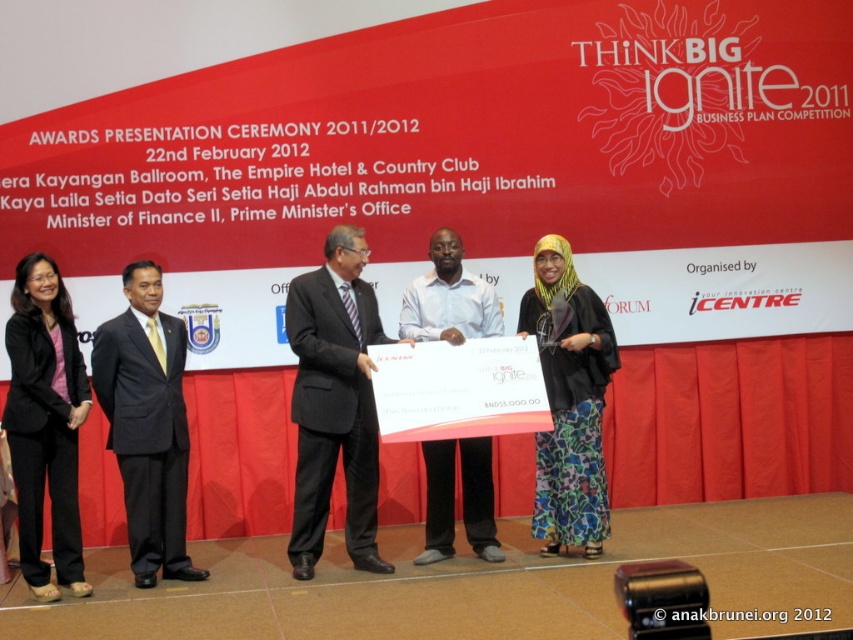
Question: Among these points, which one is farthest from the camera?

Choices:
 (A) (422, 332)
 (B) (300, 512)
 (C) (157, 536)
 (D) (50, 300)

Answer: (A)

Question: Does black suit at center have a smaller size compared to black fabric pants at lower left?

Choices:
 (A) no
 (B) yes

Answer: (A)

Question: Does floral fabric dress at center appear over white shirt at center?

Choices:
 (A) no
 (B) yes

Answer: (B)

Question: Can you confirm if black suit at left is smaller than black fabric pants at lower left?

Choices:
 (A) yes
 (B) no

Answer: (B)

Question: Among these points, which one is farthest from the camera?

Choices:
 (A) (477, 497)
 (B) (70, 528)
 (C) (137, 316)

Answer: (A)

Question: Which of the following is the farthest from the observer?

Choices:
 (A) white shirt at center
 (B) black suit at left
 (C) black suit at center

Answer: (A)